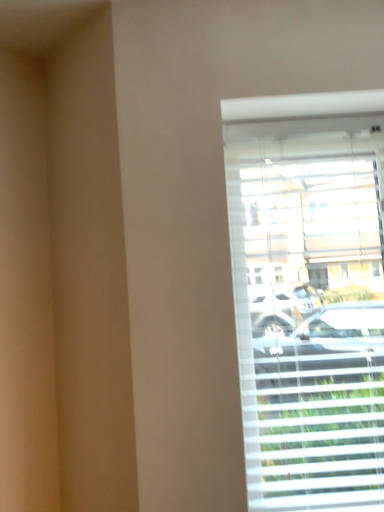
The image size is (384, 512). What do you see at coordinates (308, 296) in the screenshot?
I see `white plastic blinds at right` at bounding box center [308, 296].

I want to click on white plastic blinds at right, so pos(308,296).

Locate an element on the screen. white plastic blinds at right is located at coordinates (308, 296).